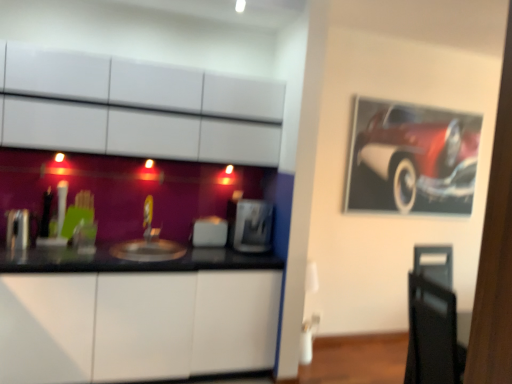
Question: Considering the relative sizes of matte silver sink at center and shiny red car at upper right in the image provided, is matte silver sink at center bigger than shiny red car at upper right?

Choices:
 (A) yes
 (B) no

Answer: (B)

Question: Can shiny red car at upper right be found inside matte silver sink at center?

Choices:
 (A) no
 (B) yes

Answer: (A)

Question: From the image's perspective, is matte silver sink at center located beneath shiny red car at upper right?

Choices:
 (A) no
 (B) yes

Answer: (B)

Question: Is matte silver sink at center oriented towards shiny red car at upper right?

Choices:
 (A) yes
 (B) no

Answer: (B)

Question: Is matte silver sink at center closer to the viewer compared to shiny red car at upper right?

Choices:
 (A) no
 (B) yes

Answer: (B)

Question: Is matte silver sink at center positioned beyond the bounds of shiny red car at upper right?

Choices:
 (A) yes
 (B) no

Answer: (A)

Question: Is satin silver toaster at left, the first appliance in the left-to-right sequence, taller than satin silver toaster at center, the second appliance positioned from the back?

Choices:
 (A) no
 (B) yes

Answer: (A)

Question: Is satin silver toaster at left, which is counted as the third appliance, starting from the back, surrounding satin silver toaster at center, which ranks as the 3th appliance in left-to-right order?

Choices:
 (A) yes
 (B) no

Answer: (B)

Question: From the image's perspective, is satin silver toaster at left, the first appliance in the left-to-right sequence, below satin silver toaster at center, which ranks as the first appliance in right-to-left order?

Choices:
 (A) yes
 (B) no

Answer: (B)

Question: Considering the relative sizes of satin silver toaster at left, the first appliance from the front, and satin silver toaster at center, which ranks as the first appliance in right-to-left order, in the image provided, is satin silver toaster at left, the first appliance from the front, smaller than satin silver toaster at center, which ranks as the first appliance in right-to-left order,?

Choices:
 (A) no
 (B) yes

Answer: (B)

Question: Are satin silver toaster at left, the first appliance from the front, and satin silver toaster at center, which ranks as the first appliance in right-to-left order, far apart?

Choices:
 (A) yes
 (B) no

Answer: (A)

Question: Can you confirm if satin silver toaster at left, which is counted as the third appliance, starting from the back, is shorter than satin silver toaster at center, the second appliance positioned from the back?

Choices:
 (A) no
 (B) yes

Answer: (B)

Question: Considering the relative sizes of satin silver toaster at left, the first appliance in the left-to-right sequence, and white glossy cabinets at upper center, the 2th cabinetry in the bottom-to-top sequence, in the image provided, is satin silver toaster at left, the first appliance in the left-to-right sequence, smaller than white glossy cabinets at upper center, the 2th cabinetry in the bottom-to-top sequence,?

Choices:
 (A) no
 (B) yes

Answer: (B)